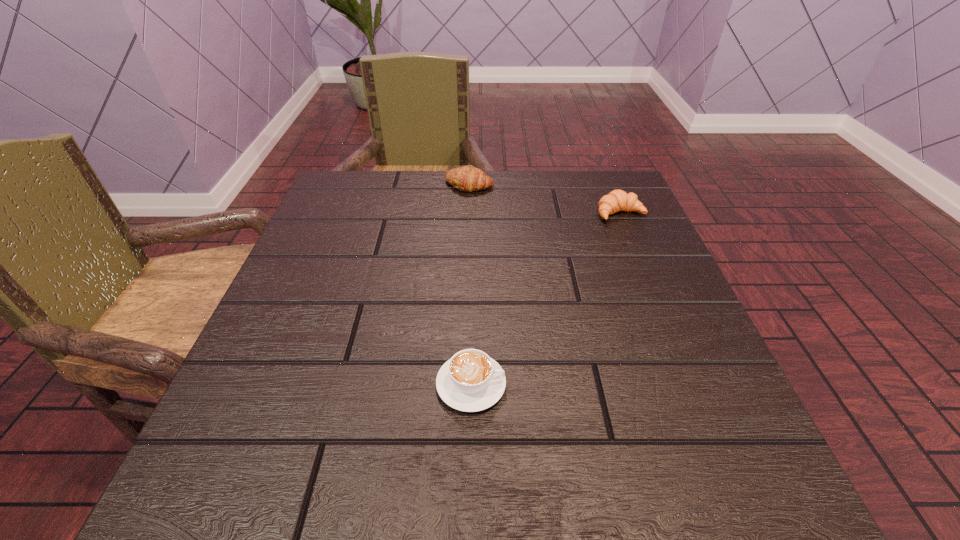
Locate an element on the screen. The width and height of the screenshot is (960, 540). free space that satisfies the following two spatial constraints: 1. on the front side of the nearer crescent roll; 2. on the right side of the farther crescent roll is located at coordinates (468, 213).

Locate an element on the screen. vacant space that satisfies the following two spatial constraints: 1. on the front side of the left crescent roll; 2. on the right side of the right crescent roll is located at coordinates (468, 213).

Locate an element on the screen. The image size is (960, 540). vacant space that satisfies the following two spatial constraints: 1. on the front side of the right crescent roll; 2. on the side of the nearest object with the handle is located at coordinates (692, 384).